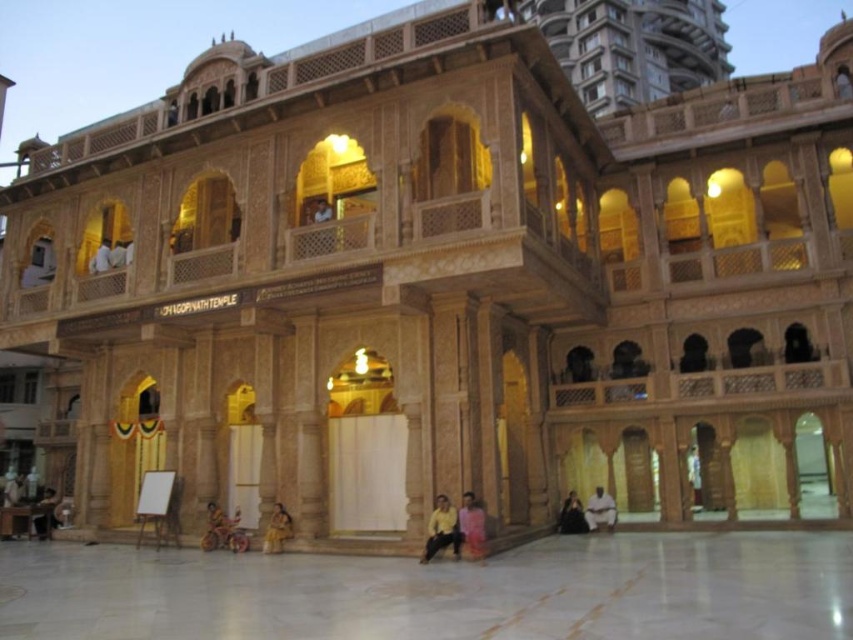
Question: Does white marble courtyard at center appear on the right side of dark skin person at lower center?

Choices:
 (A) no
 (B) yes

Answer: (A)

Question: Which object is farther from the camera taking this photo?

Choices:
 (A) white marble courtyard at center
 (B) yellow fabric at lower center
 (C) yellow fabric cloth at lower center
 (D) dark skin person at lower center

Answer: (D)

Question: Can you confirm if yellow fabric at lower center is wider than dark brown fabric at lower center?

Choices:
 (A) yes
 (B) no

Answer: (A)

Question: Which point appears closest to the camera in this image?

Choices:
 (A) (218, 538)
 (B) (572, 508)
 (C) (610, 518)
 (D) (45, 500)

Answer: (A)

Question: Is yellow fabric at lower center positioned at the back of yellow fabric cloth at lower center?

Choices:
 (A) no
 (B) yes

Answer: (A)

Question: Which object is farther from the camera taking this photo?

Choices:
 (A) yellow fabric cloth at lower center
 (B) dark brown wooden chair at lower left
 (C) white marble courtyard at center
 (D) golden fabric cloth at lower center

Answer: (B)